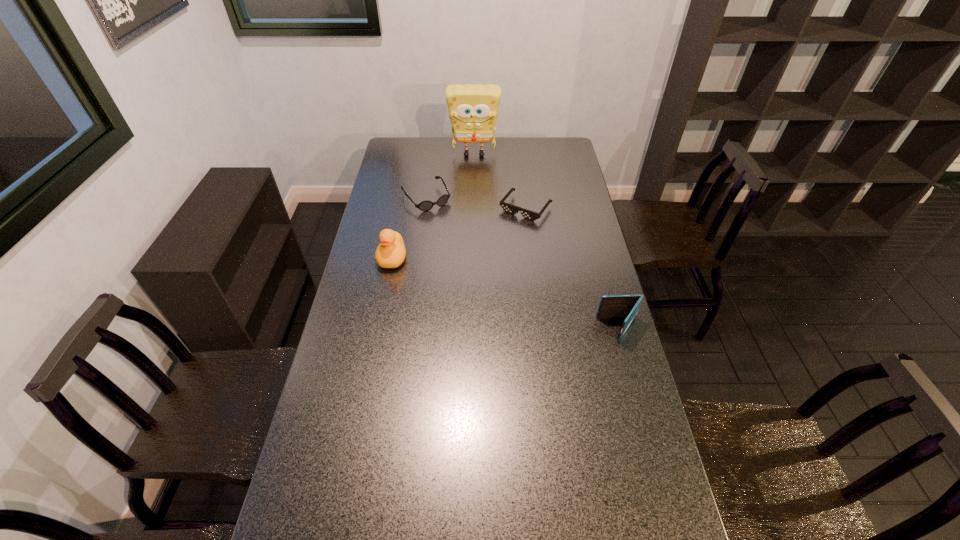
Locate an element on the screen. Image resolution: width=960 pixels, height=540 pixels. free region located on the front-facing side of the shorter sunglasses is located at coordinates (478, 268).

Image resolution: width=960 pixels, height=540 pixels. I want to click on vacant point located on the front-facing side of the shorter sunglasses, so click(x=486, y=258).

You are a GUI agent. You are given a task and a screenshot of the screen. Output one action in this format:
    pyautogui.click(x=<x>, y=<y>)
    Task: Click on the vacant position located 0.180m on the front-facing side of the shorter sunglasses
    The width and height of the screenshot is (960, 540).
    Given the screenshot: What is the action you would take?
    pyautogui.click(x=493, y=247)

The width and height of the screenshot is (960, 540). What are the coordinates of `object that is at the far edge` in the screenshot? It's located at (473, 109).

Where is `duck present at the left edge`? The image size is (960, 540). duck present at the left edge is located at coordinates (391, 252).

You are a GUI agent. You are given a task and a screenshot of the screen. Output one action in this format:
    pyautogui.click(x=<x>, y=<y>)
    Task: Click on the sunglasses that is at the left edge
    This screenshot has width=960, height=540.
    Given the screenshot: What is the action you would take?
    pyautogui.click(x=426, y=205)

Locate an element on the screen. The width and height of the screenshot is (960, 540). wallet located in the right edge section of the desktop is located at coordinates (617, 306).

You are a GUI agent. You are given a task and a screenshot of the screen. Output one action in this format:
    pyautogui.click(x=<x>, y=<y>)
    Task: Click on the sunglasses that is at the right edge
    The width and height of the screenshot is (960, 540).
    Given the screenshot: What is the action you would take?
    pyautogui.click(x=509, y=208)

Image resolution: width=960 pixels, height=540 pixels. In order to click on vacant area at the far edge in this screenshot , I will do `click(503, 145)`.

Where is `blank space at the left edge of the desktop`? The height and width of the screenshot is (540, 960). blank space at the left edge of the desktop is located at coordinates (379, 353).